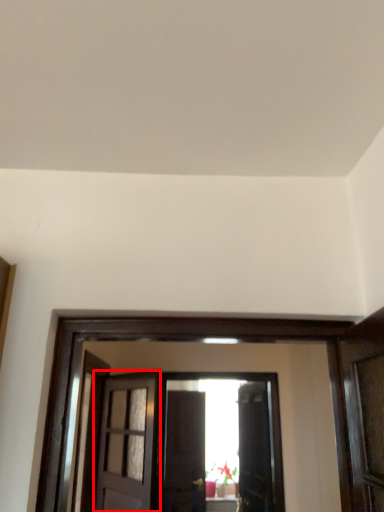
Question: From the image's perspective, what is the correct spatial positioning of door (annotated by the red box) in reference to door?

Choices:
 (A) above
 (B) below

Answer: (A)